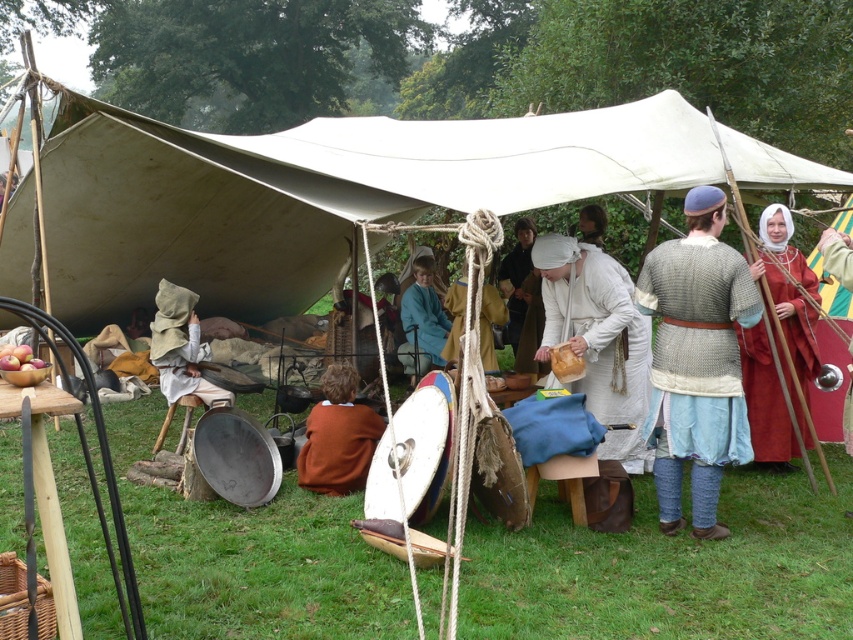
Can you confirm if chainmail shirt at right is thinner than red leather shield at right?

In fact, chainmail shirt at right might be wider than red leather shield at right.

Where is `chainmail shirt at right`? The image size is (853, 640). chainmail shirt at right is located at coordinates (695, 362).

Is point (554, 268) closer to camera compared to point (845, 262)?

No, it is not.

Can you confirm if white linen dress at center is positioned above red leather shield at right?

Correct, white linen dress at center is located above red leather shield at right.

Does point (608, 440) come behind point (840, 259)?

Yes, it is.

The height and width of the screenshot is (640, 853). I want to click on white linen dress at center, so click(598, 339).

Is blue woolen cloak at center positioned at the back of brown leather bag at center?

No, it is not.

Is point (408, 371) positioned after point (511, 305)?

No, (408, 371) is in front of (511, 305).

Is point (424, 292) farther from viewer compared to point (511, 252)?

No, (424, 292) is in front of (511, 252).

I want to click on blue woolen cloak at center, so click(x=422, y=326).